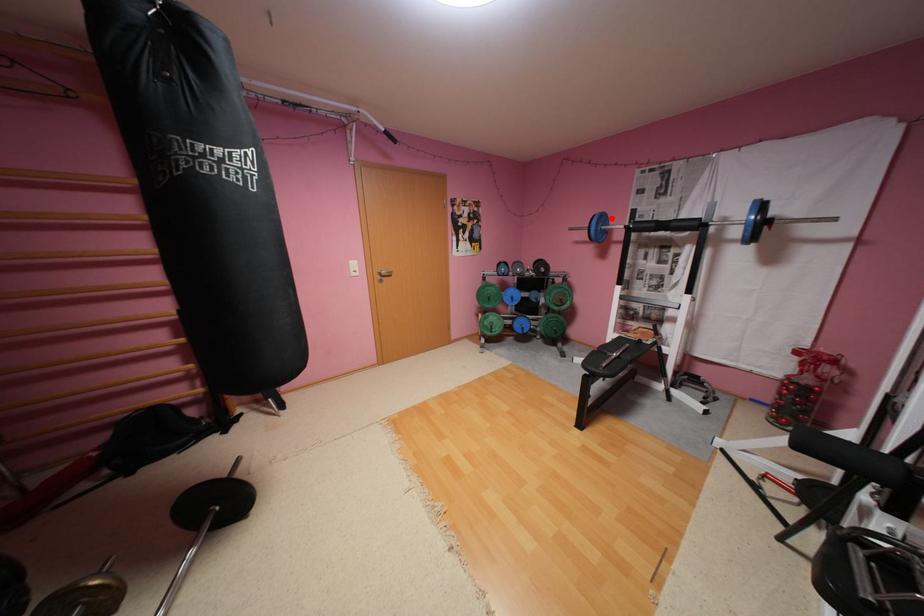
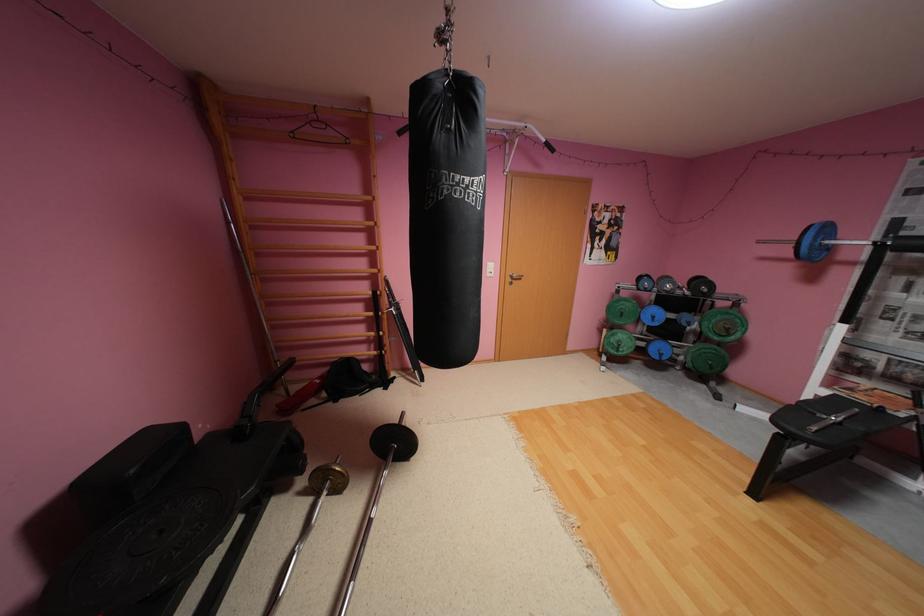
The point at the highlighted location is marked in the first image. Where is the corresponding point in the second image?

(835, 229)